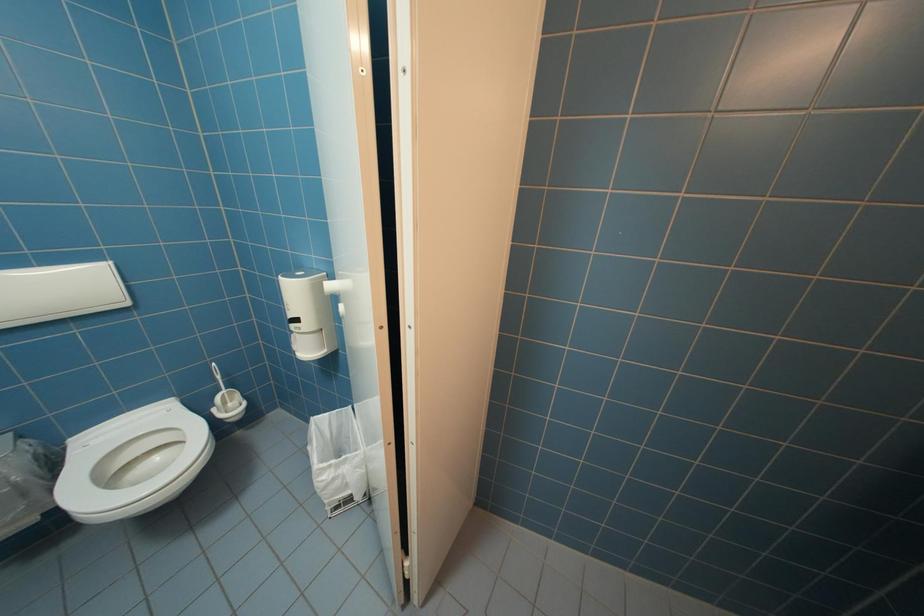
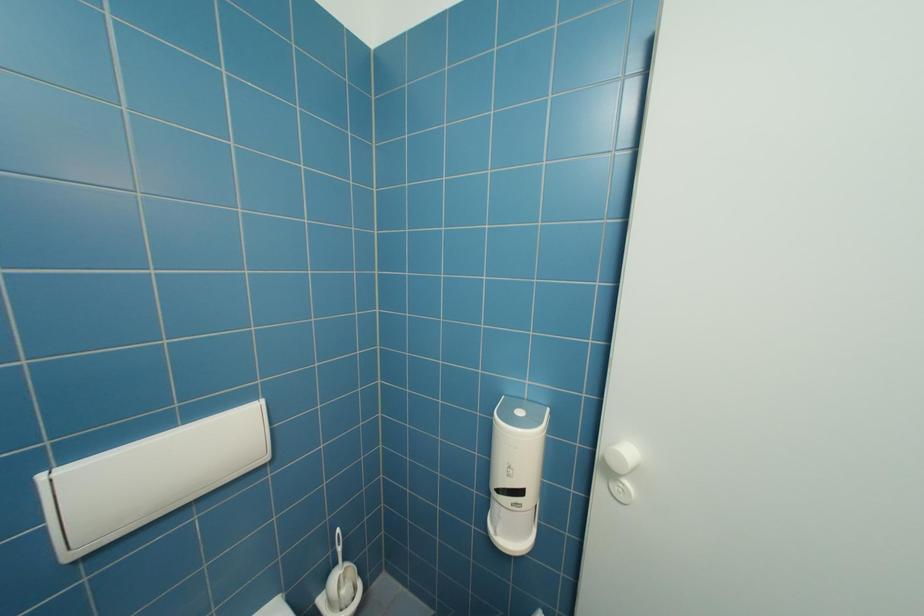
From the picture: In a continuous first-person perspective shot, in which direction is the camera moving?

The cameraman moved toward left, forward.